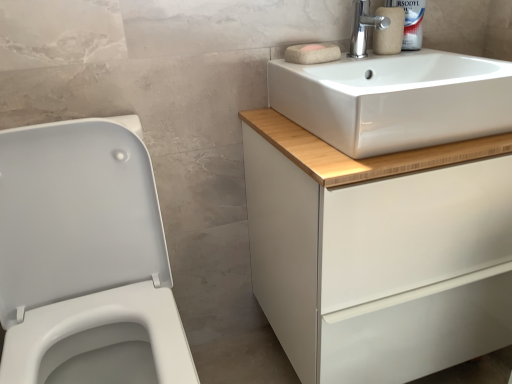
Question: Is polished chrome tap at upper right not close to white matte cabinet at upper right?

Choices:
 (A) yes
 (B) no

Answer: (B)

Question: From the image's perspective, is polished chrome tap at upper right located beneath white matte cabinet at upper right?

Choices:
 (A) yes
 (B) no

Answer: (B)

Question: Considering the relative sizes of polished chrome tap at upper right and white matte cabinet at upper right in the image provided, is polished chrome tap at upper right thinner than white matte cabinet at upper right?

Choices:
 (A) yes
 (B) no

Answer: (A)

Question: Can you confirm if polished chrome tap at upper right is positioned to the right of white matte cabinet at upper right?

Choices:
 (A) no
 (B) yes

Answer: (A)

Question: From a real-world perspective, is polished chrome tap at upper right over white matte cabinet at upper right?

Choices:
 (A) yes
 (B) no

Answer: (A)

Question: Would you say white ceramic sink at upper right is to the left or to the right of matte beige toilet paper at upper right in the picture?

Choices:
 (A) right
 (B) left

Answer: (B)

Question: Is point (384, 129) closer or farther from the camera than point (394, 43)?

Choices:
 (A) closer
 (B) farther

Answer: (A)

Question: From the image's perspective, is white ceramic sink at upper right positioned above or below matte beige toilet paper at upper right?

Choices:
 (A) above
 (B) below

Answer: (B)

Question: Considering their positions, is white ceramic sink at upper right located in front of or behind matte beige toilet paper at upper right?

Choices:
 (A) front
 (B) behind

Answer: (A)

Question: Is white matte cabinet at upper right spatially inside white glossy porcelain at left, or outside of it?

Choices:
 (A) inside
 (B) outside

Answer: (B)

Question: From a real-world perspective, relative to white glossy porcelain at left, is white matte cabinet at upper right vertically above or below?

Choices:
 (A) above
 (B) below

Answer: (B)

Question: Considering the positions of white matte cabinet at upper right and white glossy porcelain at left in the image, is white matte cabinet at upper right taller or shorter than white glossy porcelain at left?

Choices:
 (A) short
 (B) tall

Answer: (A)

Question: Looking at their shapes, would you say white matte cabinet at upper right is wider or thinner than white glossy porcelain at left?

Choices:
 (A) thin
 (B) wide

Answer: (A)

Question: Choose the correct answer: Is white glossy plastic bottle at upper right inside white matte soap at upper center, which is the 2th soap from front to back, or outside it?

Choices:
 (A) outside
 (B) inside

Answer: (A)

Question: Is point (418, 36) closer or farther from the camera than point (310, 49)?

Choices:
 (A) farther
 (B) closer

Answer: (A)